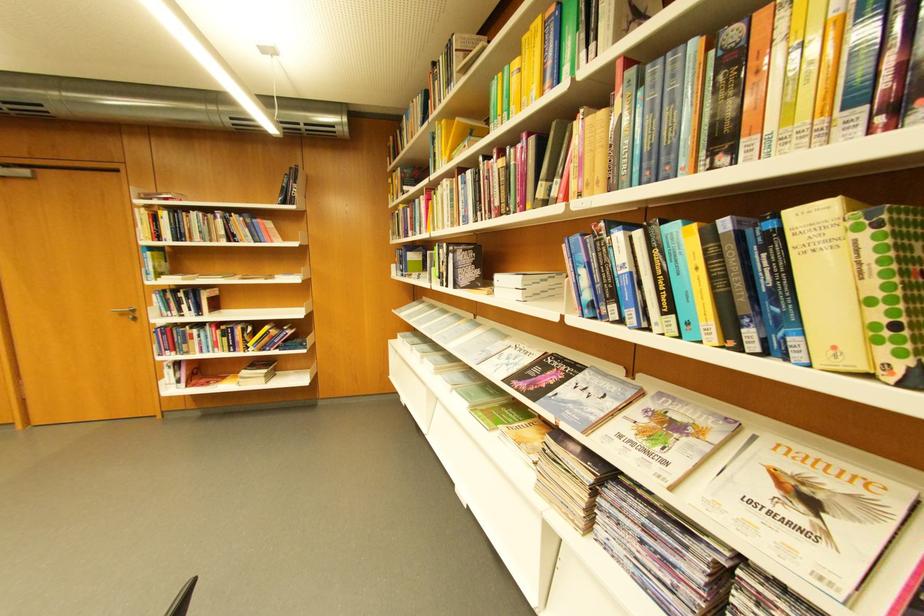
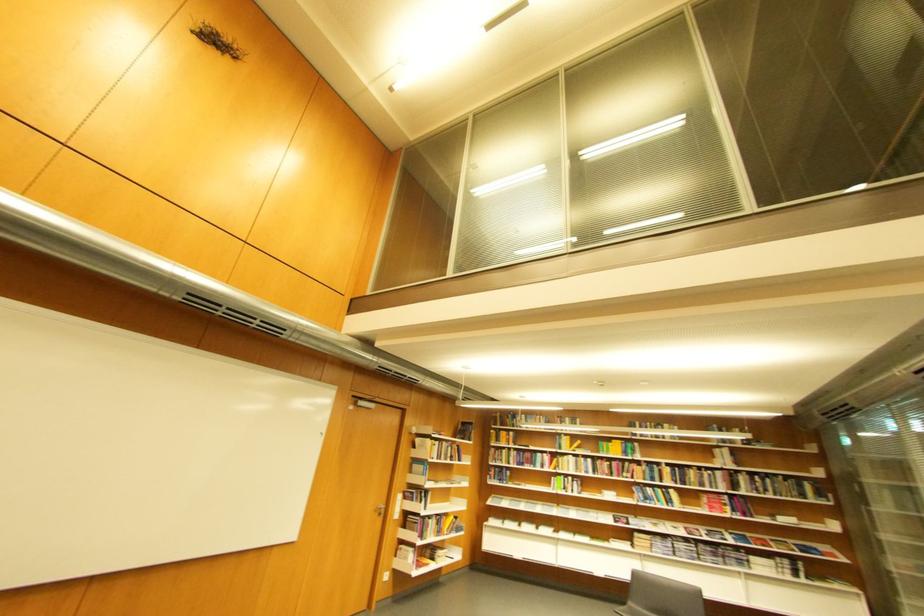
Where in the second image is the point corresponding to pixel 677 565 from the first image?

(677, 549)